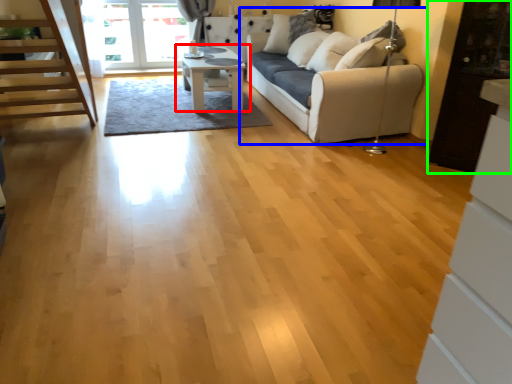
Question: Estimate the real-world distances between objects in this image. Which object is farther from table (highlighted by a red box), studio couch (highlighted by a blue box) or cabinetry (highlighted by a green box)?

Choices:
 (A) studio couch
 (B) cabinetry

Answer: (B)